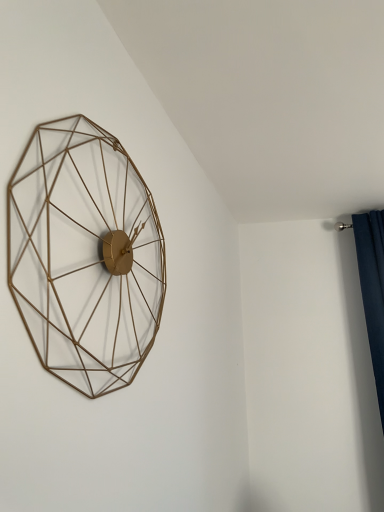
Describe the element at coordinates (372, 289) in the screenshot. I see `dark blue fabric at right` at that location.

What is the approximate height of dark blue fabric at right?

The height of dark blue fabric at right is 4.27 feet.

You are a GUI agent. You are given a task and a screenshot of the screen. Output one action in this format:
    pyautogui.click(x=<x>, y=<y>)
    Task: Click on the dark blue fabric at right
    The width and height of the screenshot is (384, 512).
    Given the screenshot: What is the action you would take?
    pyautogui.click(x=372, y=289)

What do you see at coordinates (85, 255) in the screenshot? The height and width of the screenshot is (512, 384). I see `gold wire wall clock at left` at bounding box center [85, 255].

What is the approximate height of gold wire wall clock at left?

gold wire wall clock at left is 24.96 inches in height.

Locate an element on the screen. gold wire wall clock at left is located at coordinates pyautogui.click(x=85, y=255).

This screenshot has width=384, height=512. In order to click on dark blue fabric at right in this screenshot , I will do `click(372, 289)`.

Would you say gold wire wall clock at left is to the left or to the right of dark blue fabric at right in the picture?

Clearly, gold wire wall clock at left is on the left of dark blue fabric at right in the image.

Considering the positions of objects gold wire wall clock at left and dark blue fabric at right in the image provided, who is behind, gold wire wall clock at left or dark blue fabric at right?

dark blue fabric at right.

Is point (33, 196) closer to camera compared to point (370, 212)?

Yes, point (33, 196) is in front of point (370, 212).

From the image's perspective, is gold wire wall clock at left on top of dark blue fabric at right?

Indeed, from the image's perspective, gold wire wall clock at left is shown above dark blue fabric at right.

From a real-world perspective, between gold wire wall clock at left and dark blue fabric at right, who is vertically lower?

From a 3D spatial view, dark blue fabric at right is below.

Can you confirm if gold wire wall clock at left is wider than dark blue fabric at right?

Incorrect, the width of gold wire wall clock at left does not surpass that of dark blue fabric at right.

Does gold wire wall clock at left have a greater height compared to dark blue fabric at right?

Incorrect, the height of gold wire wall clock at left is not larger of that of dark blue fabric at right.

In terms of size, does gold wire wall clock at left appear bigger or smaller than dark blue fabric at right?

In the image, gold wire wall clock at left appears to be smaller than dark blue fabric at right.

Is gold wire wall clock at left inside or outside of dark blue fabric at right?

gold wire wall clock at left lies outside dark blue fabric at right.

Is gold wire wall clock at left far from dark blue fabric at right?

gold wire wall clock at left is positioned a significant distance from dark blue fabric at right.

Is gold wire wall clock at left oriented towards dark blue fabric at right?

No, gold wire wall clock at left is not turned towards dark blue fabric at right.

Can you tell me how much gold wire wall clock at left and dark blue fabric at right differ in facing direction?

79.3 degrees.

Measure the distance from gold wire wall clock at left to dark blue fabric at right.

gold wire wall clock at left is 1.47 meters away from dark blue fabric at right.

Locate an element on the screen. Image resolution: width=384 pixels, height=512 pixels. wall clock that is above the dark blue fabric at right (from the image's perspective) is located at coordinates (85, 255).

Can you confirm if dark blue fabric at right is positioned to the right of gold wire wall clock at left?

Yes.

Does dark blue fabric at right come in front of gold wire wall clock at left?

That is False.

Which is in front, point (379, 341) or point (52, 324)?

Positioned in front is point (52, 324).

From the image's perspective, which is below, dark blue fabric at right or gold wire wall clock at left?

dark blue fabric at right.

From a real-world perspective, who is located higher, dark blue fabric at right or gold wire wall clock at left?

gold wire wall clock at left, from a real-world perspective.

From the picture: Considering the sizes of objects dark blue fabric at right and gold wire wall clock at left in the image provided, who is thinner, dark blue fabric at right or gold wire wall clock at left?

gold wire wall clock at left is thinner.

Considering the sizes of objects dark blue fabric at right and gold wire wall clock at left in the image provided, who is shorter, dark blue fabric at right or gold wire wall clock at left?

gold wire wall clock at left is shorter.

Who is smaller, dark blue fabric at right or gold wire wall clock at left?

gold wire wall clock at left.

Can we say dark blue fabric at right lies outside gold wire wall clock at left?

Yes, dark blue fabric at right is located beyond the bounds of gold wire wall clock at left.

Is dark blue fabric at right with gold wire wall clock at left?

No, dark blue fabric at right is not in contact with gold wire wall clock at left.

Is dark blue fabric at right positioned with its back to gold wire wall clock at left?

No, gold wire wall clock at left is not at the back of dark blue fabric at right.

How different are the orientations of dark blue fabric at right and gold wire wall clock at left in degrees?

79.3 degrees separate the facing orientations of dark blue fabric at right and gold wire wall clock at left.

The height and width of the screenshot is (512, 384). Find the location of `curtain below the gold wire wall clock at left (from the image's perspective)`. curtain below the gold wire wall clock at left (from the image's perspective) is located at coordinates (372, 289).

This screenshot has height=512, width=384. I want to click on wall clock that appears in front of the dark blue fabric at right, so click(85, 255).

Find the location of a particular element. curtain below the gold wire wall clock at left (from a real-world perspective) is located at coordinates (372, 289).